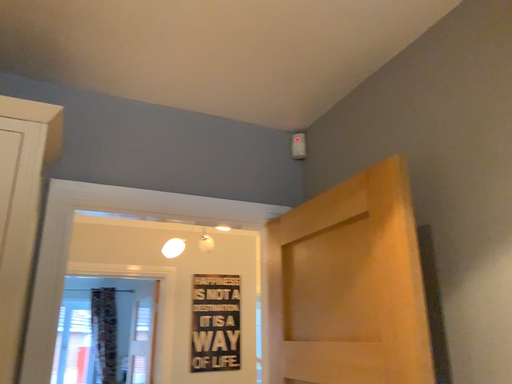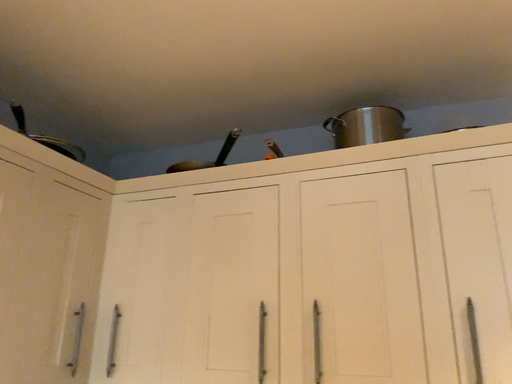
Question: How did the camera likely rotate when shooting the video?

Choices:
 (A) rotated downward
 (B) rotated upward

Answer: (A)